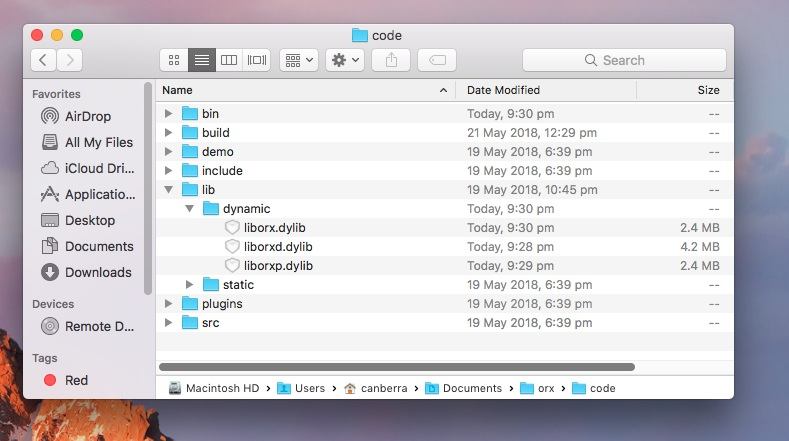
Locate an element on the screen. folders is located at coordinates (200, 119), (196, 138), (193, 156), (195, 170), (195, 192), (217, 211), (217, 284), (200, 306), (195, 337).